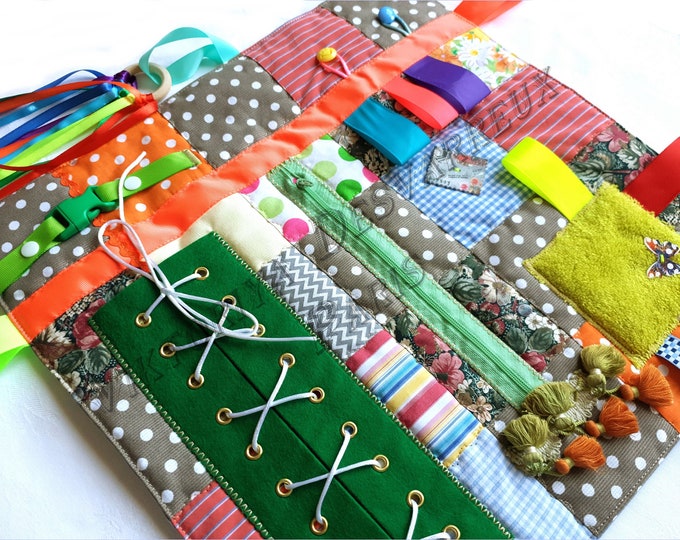
Locate an element on the screen. The height and width of the screenshot is (540, 680). tassle is located at coordinates (524, 442), (581, 456), (551, 395), (613, 425), (598, 368), (642, 388).